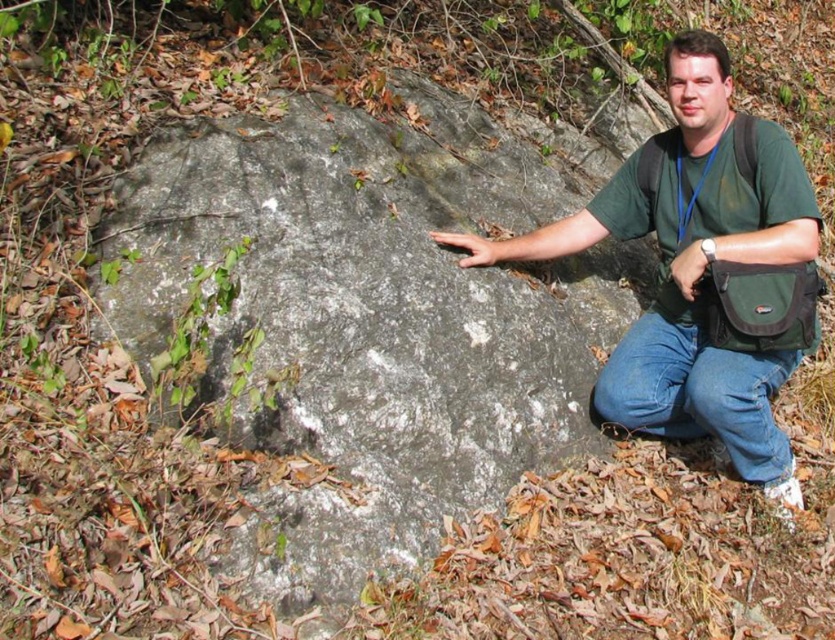
In the scene shown: Which is below, green fabric bag at center or smooth gray rock at center?

green fabric bag at center is below.

Who is positioned more to the right, green fabric bag at center or smooth gray rock at center?

From the viewer's perspective, green fabric bag at center appears more on the right side.

In order to click on green fabric bag at center in this screenshot , I will do `click(701, 276)`.

Can you confirm if denim jeans at lower right is positioned to the right of smooth gray rock at center?

Correct, you'll find denim jeans at lower right to the right of smooth gray rock at center.

Is point (750, 422) positioned before point (483, 237)?

Yes, it is.

The height and width of the screenshot is (640, 835). Describe the element at coordinates (697, 394) in the screenshot. I see `denim jeans at lower right` at that location.

Identify the location of denim jeans at lower right. This screenshot has height=640, width=835. (697, 394).

Locate an element on the screen. This screenshot has height=640, width=835. gray rough rock at center is located at coordinates (373, 316).

I want to click on gray rough rock at center, so click(x=373, y=316).

You are a GUI agent. You are given a task and a screenshot of the screen. Output one action in this format:
    pyautogui.click(x=<x>, y=<y>)
    Task: Click on the gray rough rock at center
    The height and width of the screenshot is (640, 835).
    Given the screenshot: What is the action you would take?
    coord(373,316)